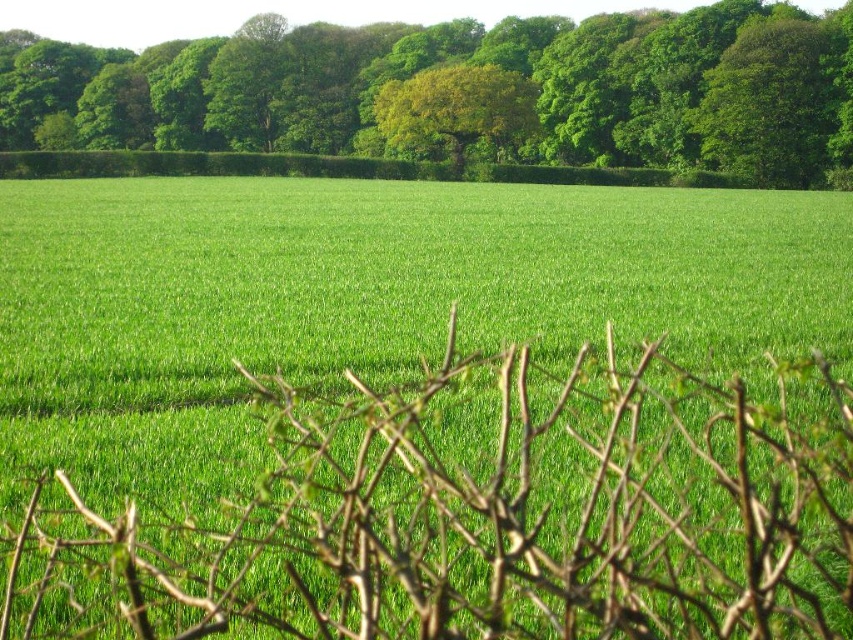
Looking at this image, does green leafy tree at upper center have a larger size compared to green leafy tree at center?

Yes, green leafy tree at upper center is bigger than green leafy tree at center.

Does point (683, 136) come closer to viewer compared to point (480, 129)?

That is False.

Where is `green leafy tree at upper center`? green leafy tree at upper center is located at coordinates (466, 92).

What are the coordinates of `green leafy tree at upper center` in the screenshot? It's located at (466, 92).

Image resolution: width=853 pixels, height=640 pixels. Find the location of `green grass at center`. green grass at center is located at coordinates (440, 401).

Looking at this image, can you confirm if green grass at center is taller than green leafy tree at center?

In fact, green grass at center may be shorter than green leafy tree at center.

Does green grass at center have a larger size compared to green leafy tree at center?

Indeed, green grass at center has a larger size compared to green leafy tree at center.

Is point (700, 240) farther from camera compared to point (428, 100)?

No.

Where is `green grass at center`? Image resolution: width=853 pixels, height=640 pixels. green grass at center is located at coordinates (440, 401).